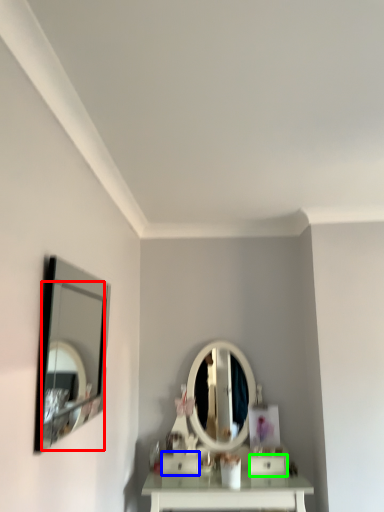
Question: Which is farther away from mirror (highlighted by a red box)? drawer (highlighted by a blue box) or drawer (highlighted by a green box)?

Choices:
 (A) drawer
 (B) drawer

Answer: (B)